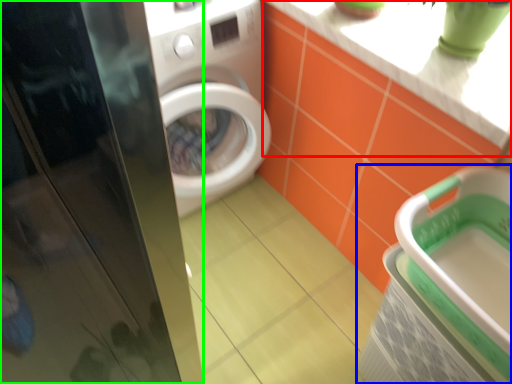
Question: Based on their relative distances, which object is farther from counter top (highlighted by a red box)? Choose from dish washer (highlighted by a blue box) and screen door (highlighted by a green box).

Choices:
 (A) dish washer
 (B) screen door

Answer: (B)